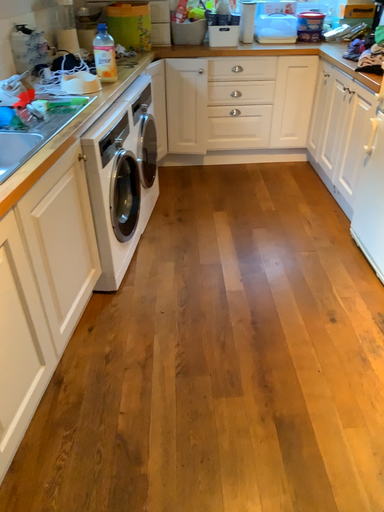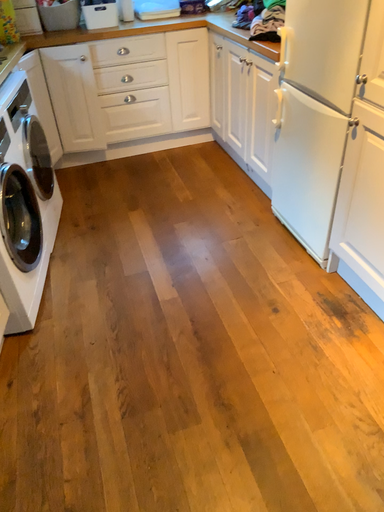
Question: How did the camera likely rotate when shooting the video?

Choices:
 (A) rotated left
 (B) rotated right

Answer: (B)